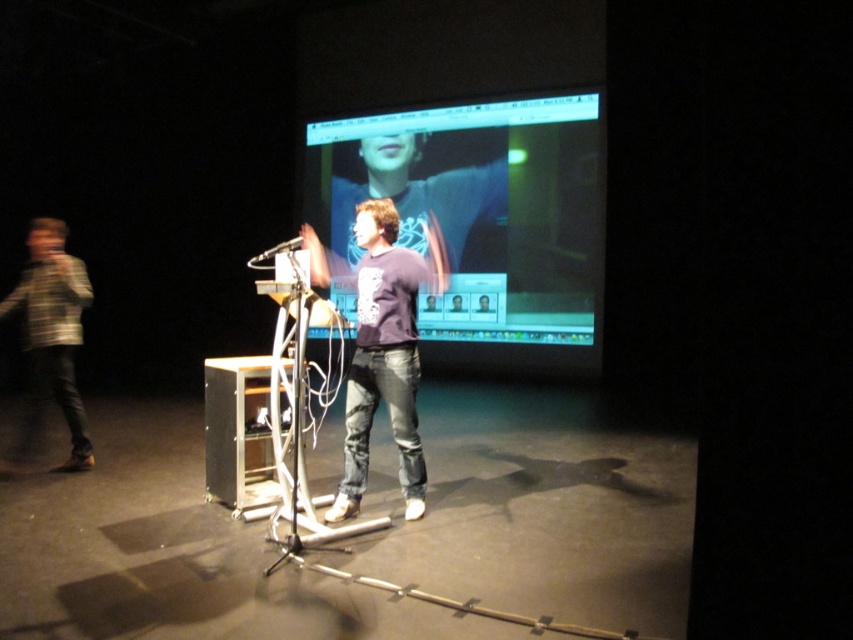
Who is taller, purple matte shirt at center or striped knit sweater at left?

purple matte shirt at center

Based on the photo, does purple matte shirt at center appear on the left side of striped knit sweater at left?

No, purple matte shirt at center is not to the left of striped knit sweater at left.

Does point (419, 204) come farther from viewer compared to point (45, 317)?

That is True.

What are the coordinates of `purple matte shirt at center` in the screenshot? It's located at pos(415,196).

Consider the image. Is matte black monitor at center closer to the viewer compared to striped knit sweater at left?

That is False.

Which is below, matte black monitor at center or striped knit sweater at left?

striped knit sweater at left is lower down.

This screenshot has width=853, height=640. In order to click on matte black monitor at center in this screenshot , I will do `click(479, 216)`.

Is purple matte shirt at center smaller than metallic silver microphone at center?

Yes, purple matte shirt at center is smaller than metallic silver microphone at center.

Can you confirm if purple matte shirt at center is thinner than metallic silver microphone at center?

In fact, purple matte shirt at center might be wider than metallic silver microphone at center.

The height and width of the screenshot is (640, 853). Describe the element at coordinates (415, 196) in the screenshot. I see `purple matte shirt at center` at that location.

Where is `purple matte shirt at center`? purple matte shirt at center is located at coordinates (415, 196).